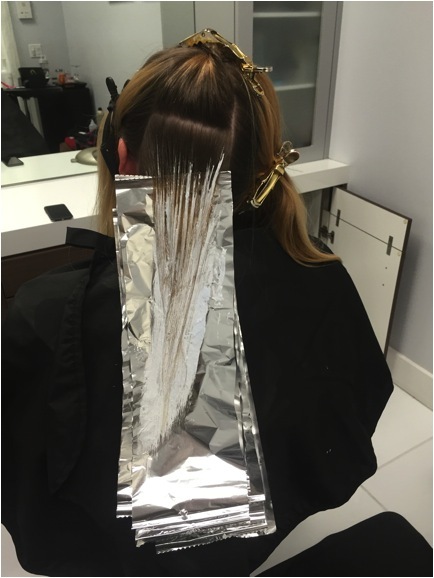
Identify the location of mirror. This screenshot has height=578, width=434. (81, 48).